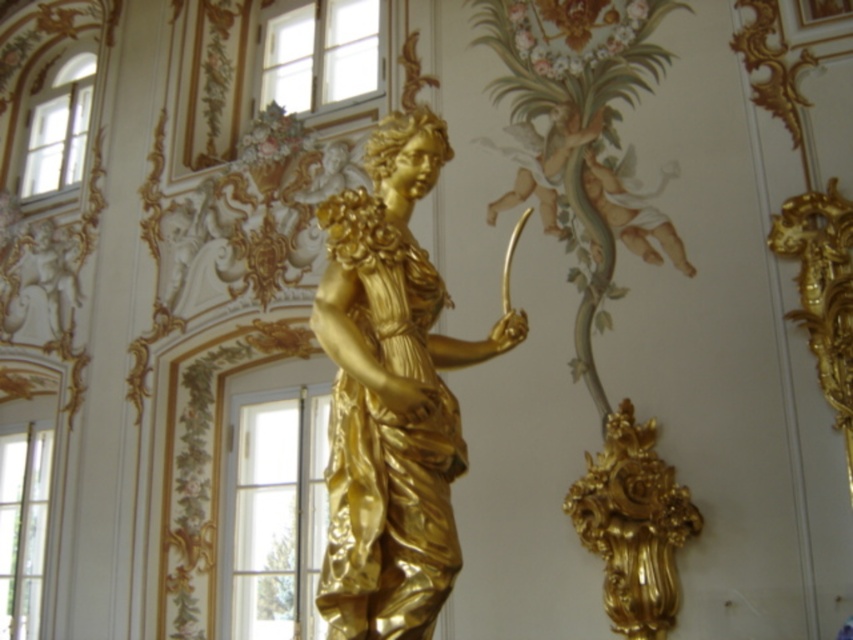
Which is behind, point (335, 470) or point (670, 557)?

Point (670, 557)

In order to click on gold polished statue at center in this screenshot , I will do `click(392, 394)`.

The width and height of the screenshot is (853, 640). In order to click on gold polished statue at center in this screenshot , I will do `click(392, 394)`.